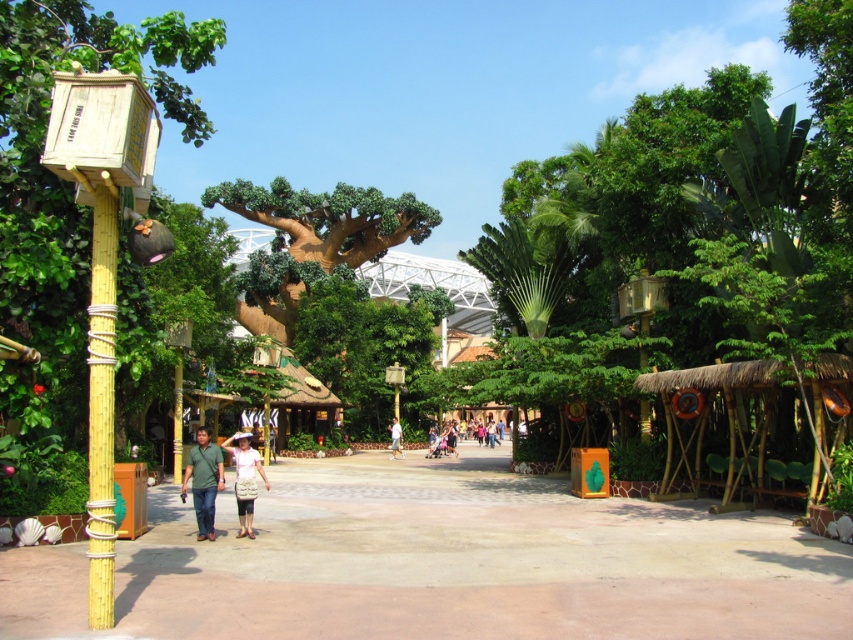
Question: Is brown textured tree at center closer to the viewer compared to white fabric shirt at center?

Choices:
 (A) yes
 (B) no

Answer: (B)

Question: Which object appears farthest from the camera in this image?

Choices:
 (A) brown concrete path at center
 (B) green fabric shirt at lower left

Answer: (B)

Question: Does bamboo wrapped at left appear under white fabric shirt at center?

Choices:
 (A) no
 (B) yes

Answer: (A)

Question: Is green fabric shirt at lower left wider than light pink fabric dress at center?

Choices:
 (A) no
 (B) yes

Answer: (A)

Question: Which of the following is the closest to the observer?

Choices:
 (A) [285, 180]
 (B) [222, 477]
 (C) [421, 627]
 (D) [91, 566]

Answer: (D)

Question: Among these points, which one is farthest from the camera?

Choices:
 (A) (242, 184)
 (B) (202, 486)
 (C) (397, 451)

Answer: (A)